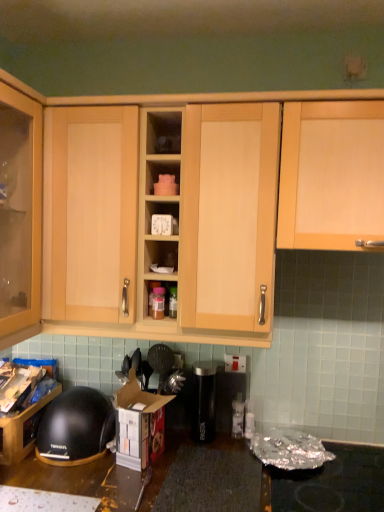
Question: Is black matte helmet at lower left behind black plastic canister at center, which appears as the first appliance when viewed from the left?

Choices:
 (A) yes
 (B) no

Answer: (B)

Question: Is black matte helmet at lower left taller than black plastic canister at center, which appears as the first appliance when viewed from the left?

Choices:
 (A) no
 (B) yes

Answer: (A)

Question: Is black matte helmet at lower left at the right side of black plastic canister at center, which appears as the first appliance when viewed from the left?

Choices:
 (A) yes
 (B) no

Answer: (B)

Question: Is black matte helmet at lower left next to black plastic canister at center, which ranks as the 2th appliance in right-to-left order?

Choices:
 (A) yes
 (B) no

Answer: (B)

Question: Could you tell me if black matte helmet at lower left is facing black plastic canister at center, which ranks as the 2th appliance in right-to-left order?

Choices:
 (A) no
 (B) yes

Answer: (A)

Question: Is point [x=51, y=406] positioned closer to the camera than point [x=26, y=428]?

Choices:
 (A) farther
 (B) closer

Answer: (A)

Question: From a real-world perspective, is black matte helmet at lower left positioned above or below black plastic bowl at lower left, which appears as the first cabinetry when viewed from the left?

Choices:
 (A) below
 (B) above

Answer: (B)

Question: Based on their sizes in the image, would you say black matte helmet at lower left is bigger or smaller than black plastic bowl at lower left, which appears as the first cabinetry when viewed from the left?

Choices:
 (A) big
 (B) small

Answer: (B)

Question: From the image's perspective, is black matte helmet at lower left above or below black plastic bowl at lower left, which is the third cabinetry from right to left?

Choices:
 (A) above
 (B) below

Answer: (A)

Question: In terms of size, does black matte helmet at lower left appear bigger or smaller than white cardboard box at lower center?

Choices:
 (A) big
 (B) small

Answer: (A)

Question: Considering their positions, is black matte helmet at lower left located in front of or behind white cardboard box at lower center?

Choices:
 (A) front
 (B) behind

Answer: (B)

Question: Is black matte helmet at lower left to the left or to the right of white cardboard box at lower center in the image?

Choices:
 (A) right
 (B) left

Answer: (B)

Question: Considering the positions of black matte helmet at lower left and white cardboard box at lower center in the image, is black matte helmet at lower left wider or thinner than white cardboard box at lower center?

Choices:
 (A) wide
 (B) thin

Answer: (A)

Question: Considering the positions of light wood cabinet door at upper right, which ranks as the first cabinetry in right-to-left order, and light wood cabinet at center, which appears as the 2th cabinetry when viewed from the left, in the image, is light wood cabinet door at upper right, which ranks as the first cabinetry in right-to-left order, wider or thinner than light wood cabinet at center, which appears as the 2th cabinetry when viewed from the left,?

Choices:
 (A) wide
 (B) thin

Answer: (A)

Question: Do you think light wood cabinet door at upper right, the 3th cabinetry from the left, is within light wood cabinet at center, which appears as the 2th cabinetry when viewed from the left, or outside of it?

Choices:
 (A) inside
 (B) outside

Answer: (B)